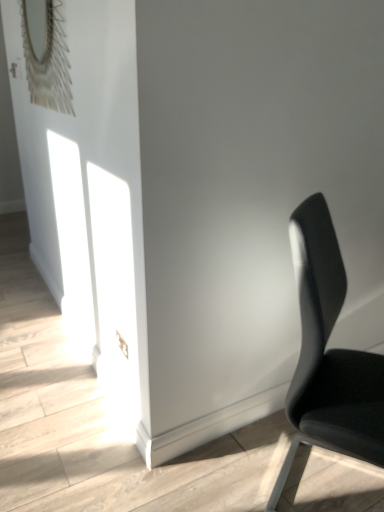
Question: Considering the positions of black leather chair at right and matte silver mirror at upper left in the image, is black leather chair at right wider or thinner than matte silver mirror at upper left?

Choices:
 (A) thin
 (B) wide

Answer: (B)

Question: Is black leather chair at right bigger or smaller than matte silver mirror at upper left?

Choices:
 (A) small
 (B) big

Answer: (B)

Question: From the image's perspective, is black leather chair at right positioned above or below matte silver mirror at upper left?

Choices:
 (A) below
 (B) above

Answer: (A)

Question: From a real-world perspective, is matte silver mirror at upper left physically located above or below black leather chair at right?

Choices:
 (A) above
 (B) below

Answer: (A)

Question: Is matte silver mirror at upper left spatially inside black leather chair at right, or outside of it?

Choices:
 (A) inside
 (B) outside

Answer: (B)

Question: Is point (46, 11) closer or farther from the camera than point (312, 246)?

Choices:
 (A) farther
 (B) closer

Answer: (A)

Question: Would you say matte silver mirror at upper left is to the left or to the right of black leather chair at right in the picture?

Choices:
 (A) right
 (B) left

Answer: (B)